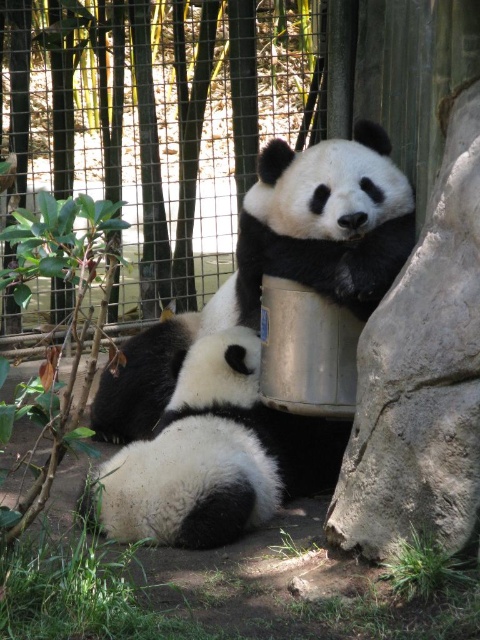
Is gray rough stone at right taller than black fuzzy panda at center?

Yes.

Describe the element at coordinates (421, 376) in the screenshot. I see `gray rough stone at right` at that location.

Is point (442, 435) farther from camera compared to point (319, 278)?

No, it is not.

This screenshot has width=480, height=640. I want to click on gray rough stone at right, so click(x=421, y=376).

Looking at this image, does black matte panda at center appear on the right side of black fuzzy panda at center?

Incorrect, black matte panda at center is not on the right side of black fuzzy panda at center.

Between black matte panda at center and black fuzzy panda at center, which one is positioned higher?

black fuzzy panda at center is higher up.

Between point (240, 289) and point (354, 305), which one is positioned behind?

The point (240, 289) is more distant.

Where is `black matte panda at center`? The height and width of the screenshot is (640, 480). black matte panda at center is located at coordinates (279, 260).

Can you confirm if brushed metal fence at upper center is shorter than black fuzzy panda at center?

In fact, brushed metal fence at upper center may be taller than black fuzzy panda at center.

Is point (152, 106) less distant than point (400, 186)?

No, it is behind (400, 186).

Describe the element at coordinates (159, 120) in the screenshot. The image size is (480, 640). I see `brushed metal fence at upper center` at that location.

Locate an element on the screen. The width and height of the screenshot is (480, 640). brushed metal fence at upper center is located at coordinates (159, 120).